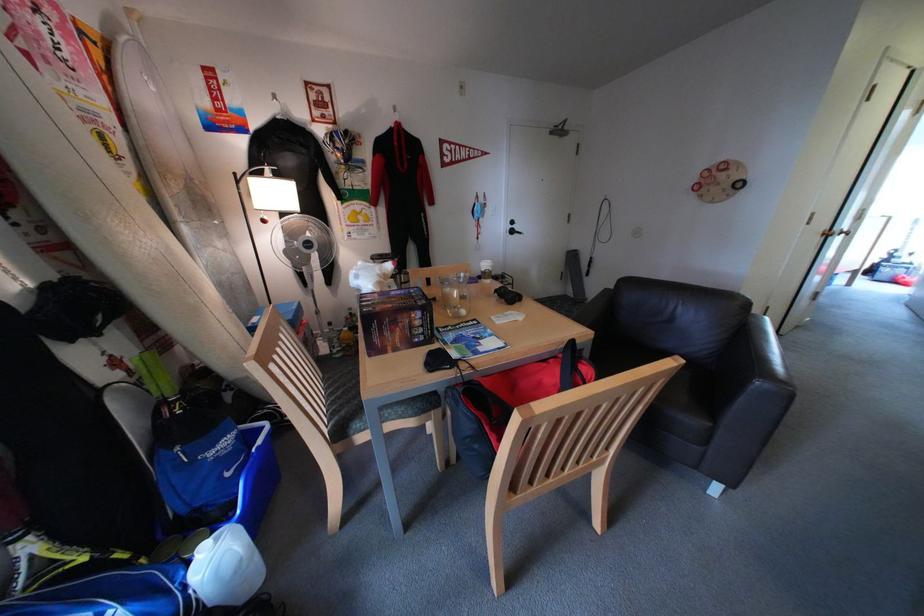
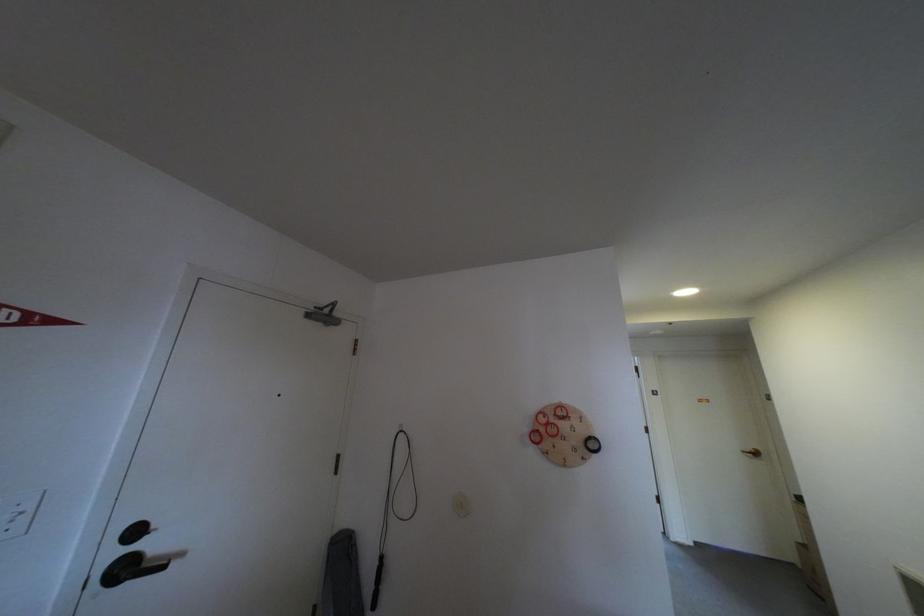
Where in the second image is the point corresponding to (526,233) from the first image?

(140, 570)